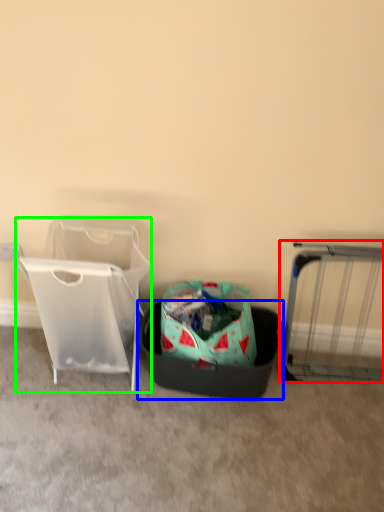
Question: Which object is positioned closest to furniture (highlighted by a red box)? Select from laundry basket (highlighted by a blue box) and baby carriage (highlighted by a green box).

Choices:
 (A) laundry basket
 (B) baby carriage

Answer: (A)